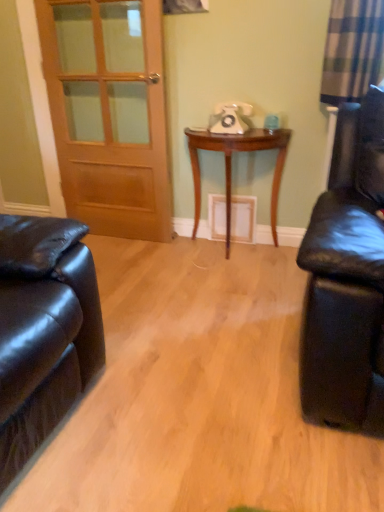
What are the coordinates of `free space that is to the left of woodenmaterial/texturetable at center` in the screenshot? It's located at (155, 262).